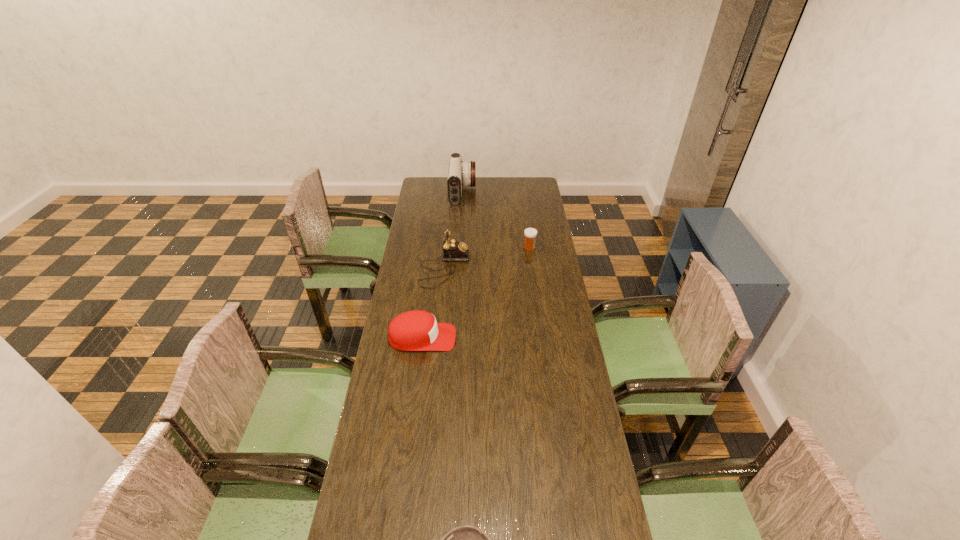
Locate an element on the screen. The height and width of the screenshot is (540, 960). telephone that is at the left edge is located at coordinates (453, 250).

I want to click on baseball cap at the left edge, so click(417, 330).

Locate an element on the screen. object that is at the right edge is located at coordinates (530, 234).

Where is `vacant space at the far edge of the desktop`? This screenshot has width=960, height=540. vacant space at the far edge of the desktop is located at coordinates (485, 187).

At what (x,y) coordinates should I click in order to perform the action: click on vacant space at the left edge of the desktop. Please return your answer as a coordinate pair (x, y). Looking at the image, I should click on (383, 462).

Identify the location of vacant space at the right edge. (540, 399).

At what (x,y) coordinates should I click in order to perform the action: click on free space at the far left corner of the desktop. Please return your answer as a coordinate pair (x, y). Looking at the image, I should click on (418, 194).

Image resolution: width=960 pixels, height=540 pixels. I want to click on vacant area that lies between the fourth shortest object and the medicine, so click(487, 258).

Locate an element on the screen. empty location between the camcorder and the fourth farthest object is located at coordinates (443, 265).

At what (x,y) coordinates should I click in order to perform the action: click on free space between the rightmost object and the second nearest object. Please return your answer as a coordinate pair (x, y). Image resolution: width=960 pixels, height=540 pixels. Looking at the image, I should click on (476, 293).